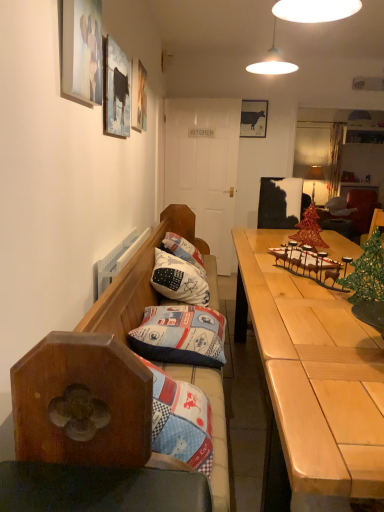
Find the location of a particular element. The image size is (384, 512). matte wooden picture frame at upper left, marked as the third picture frame in a right-to-left arrangement is located at coordinates (115, 90).

This screenshot has width=384, height=512. Describe the element at coordinates (115, 90) in the screenshot. I see `matte wooden picture frame at upper left, arranged as the 3th picture frame when viewed from the back` at that location.

Locate an element on the screen. The image size is (384, 512). wooden bench with cushions at left is located at coordinates [95, 356].

Where is `matte glass lampshade at upper right`? The width and height of the screenshot is (384, 512). matte glass lampshade at upper right is located at coordinates (316, 185).

This screenshot has width=384, height=512. Describe the element at coordinates (316, 185) in the screenshot. I see `matte glass lampshade at upper right` at that location.

Identify the location of matte wooden picture frame at upper left, the 1th picture frame viewed from the front. The width and height of the screenshot is (384, 512). (82, 50).

From a real-world perspective, is wooden picture frame at upper center, which is the 3th picture frame from front to back, positioned under light wood table at right based on gravity?

No.

Would you say light wood table at right is part of wooden picture frame at upper center, which is the 3th picture frame from front to back,'s contents?

Actually, light wood table at right is outside wooden picture frame at upper center, which is the 3th picture frame from front to back.

Which is in front, point (183, 283) or point (142, 80)?

The point (183, 283) is closer.

Considering the sizes of white cotton pillow at center, placed as the first pillow when sorted from back to front, and wooden picture frame at upper center, acting as the 3th picture frame starting from the left, in the image, is white cotton pillow at center, placed as the first pillow when sorted from back to front, wider or thinner than wooden picture frame at upper center, acting as the 3th picture frame starting from the left,?

In the image, white cotton pillow at center, placed as the first pillow when sorted from back to front, appears to be wider than wooden picture frame at upper center, acting as the 3th picture frame starting from the left.

Is white cotton pillow at center, the 2th pillow in the front-to-back sequence, not close to wooden picture frame at upper center, acting as the 3th picture frame starting from the left?

No, white cotton pillow at center, the 2th pillow in the front-to-back sequence, is not far away from wooden picture frame at upper center, acting as the 3th picture frame starting from the left.

Looking at this image, between light wood table at right and white cotton pillow at center, placed as the first pillow when sorted from back to front, which one has smaller size?

With smaller size is white cotton pillow at center, placed as the first pillow when sorted from back to front.

From the image's perspective, which is above, light wood table at right or white cotton pillow at center, the 2th pillow in the front-to-back sequence?

white cotton pillow at center, the 2th pillow in the front-to-back sequence, from the image's perspective.

Looking at this image, does light wood table at right contain white cotton pillow at center, placed as the first pillow when sorted from back to front?

No, white cotton pillow at center, placed as the first pillow when sorted from back to front, is located outside of light wood table at right.

Considering the positions of points (324, 405) and (179, 260), is point (324, 405) closer to camera compared to point (179, 260)?

That is True.

Is wooden picture frame at upper center, which is the 3th picture frame from front to back, at the back of matte black cow at upper center, which is the first picture frame in back-to-front order?

No, matte black cow at upper center, which is the first picture frame in back-to-front order, is not facing away from wooden picture frame at upper center, which is the 3th picture frame from front to back.

From a real-world perspective, is matte black cow at upper center, the fourth picture frame from the left, above or below wooden picture frame at upper center, which is the 3th picture frame from front to back?

In terms of real-world spatial position, matte black cow at upper center, the fourth picture frame from the left, is above wooden picture frame at upper center, which is the 3th picture frame from front to back.

Is wooden picture frame at upper center, acting as the 3th picture frame starting from the left, surrounded by matte black cow at upper center, placed as the first picture frame when sorted from right to left?

No, wooden picture frame at upper center, acting as the 3th picture frame starting from the left, is not a part of matte black cow at upper center, placed as the first picture frame when sorted from right to left.

Which object is further away from the camera, matte black cow at upper center, the fourth picture frame from the left, or wooden picture frame at upper center, acting as the 3th picture frame starting from the left?

matte black cow at upper center, the fourth picture frame from the left, is further away from the camera.

Is matte wooden picture frame at upper left, the 1th picture frame when ordered from left to right, positioned with its back to light wood table at right?

No.

Is matte wooden picture frame at upper left, marked as the 4th picture frame in a right-to-left arrangement, beside light wood table at right?

matte wooden picture frame at upper left, marked as the 4th picture frame in a right-to-left arrangement, and light wood table at right are clearly separated.

How much distance is there between matte wooden picture frame at upper left, the 1th picture frame viewed from the front, and light wood table at right?

matte wooden picture frame at upper left, the 1th picture frame viewed from the front, is 3.83 feet away from light wood table at right.

Which of these two, matte wooden picture frame at upper left, marked as the 4th picture frame in a right-to-left arrangement, or light wood table at right, is smaller?

Smaller between the two is matte wooden picture frame at upper left, marked as the 4th picture frame in a right-to-left arrangement.

Looking at this image, which of these two, velvet dark brown bean bag chair at right or light wood table at right, is bigger?

light wood table at right is bigger.

Considering the relative positions of velvet dark brown bean bag chair at right and light wood table at right in the image provided, is velvet dark brown bean bag chair at right to the left of light wood table at right from the viewer's perspective?

No.

Identify the location of desk lying below the velvet dark brown bean bag chair at right (from the image's perspective). The height and width of the screenshot is (512, 384). (311, 380).

Is white cotton pillow at center, placed as the first pillow when sorted from back to front, looking in the opposite direction of wooden bench with cushions at left?

Yes, white cotton pillow at center, placed as the first pillow when sorted from back to front, is facing away from wooden bench with cushions at left.

Are white cotton pillow at center, the 2th pillow in the front-to-back sequence, and wooden bench with cushions at left beside each other?

No, white cotton pillow at center, the 2th pillow in the front-to-back sequence, is not with wooden bench with cushions at left.

Is point (189, 270) more distant than point (110, 399)?

Yes, it is behind point (110, 399).

Which of these two, white cotton pillow at center, placed as the first pillow when sorted from back to front, or wooden bench with cushions at left, stands shorter?

white cotton pillow at center, placed as the first pillow when sorted from back to front.

Identify the location of desk in front of the wooden picture frame at upper center, which is the 3th picture frame from front to back. The image size is (384, 512). (311, 380).

Which picture frame is the 1st one when counting from the back of the white cotton pillow at center, placed as the first pillow when sorted from back to front? Please provide its 2D coordinates.

[(138, 96)]

Estimate the real-world distances between objects in this image. Which object is further from matte black cow at upper center, the fourth picture frame from the left, wooden picture frame at upper center, positioned as the 2th picture frame in back-to-front order, or velvet dark brown bean bag chair at right?

wooden picture frame at upper center, positioned as the 2th picture frame in back-to-front order, is positioned further to the anchor matte black cow at upper center, the fourth picture frame from the left.

Based on their spatial positions, is light wood table at right or white cotton pillow at center, the 2th pillow in the front-to-back sequence, closer to matte wooden picture frame at upper left, the 1th picture frame viewed from the front?

Based on the image, light wood table at right appears to be nearer to matte wooden picture frame at upper left, the 1th picture frame viewed from the front.

Considering their positions, is wooden picture frame at upper center, which is the 3th picture frame from front to back, positioned closer to matte glass lampshade at upper right than matte wooden picture frame at upper left, the 1th picture frame viewed from the front?

The object closer to matte glass lampshade at upper right is wooden picture frame at upper center, which is the 3th picture frame from front to back.

Looking at the image, which one is located further to wooden picture frame at upper center, acting as the 3th picture frame starting from the left, matte wooden picture frame at upper left, the fourth picture frame viewed from the back, or wooden bench with cushions at left?

wooden bench with cushions at left is further to wooden picture frame at upper center, acting as the 3th picture frame starting from the left.

In the scene shown: Considering their positions, is matte glass lampshade at upper right positioned closer to matte wooden picture frame at upper left, marked as the 4th picture frame in a right-to-left arrangement, than matte wooden picture frame at upper left, which is the 2th picture frame in front-to-back order?

matte wooden picture frame at upper left, which is the 2th picture frame in front-to-back order.

From the image, which object appears to be farther from matte wooden picture frame at upper left, the 1th picture frame when ordered from left to right, light wood table at right or velvet dark brown bean bag chair at right?

Based on the image, velvet dark brown bean bag chair at right appears to be further to matte wooden picture frame at upper left, the 1th picture frame when ordered from left to right.

Estimate the real-world distances between objects in this image. Which object is closer to wooden picture frame at upper center, placed as the 2th picture frame when sorted from right to left, matte glass lampshade at upper right or white cotton pillow at center, the 2th pillow in the front-to-back sequence?

white cotton pillow at center, the 2th pillow in the front-to-back sequence.

Estimate the real-world distances between objects in this image. Which object is further from wooden picture frame at upper center, acting as the 3th picture frame starting from the left, blue cotton cushion at center, placed as the 2th pillow when sorted from back to front, or white cotton pillow at center, the 2th pillow in the front-to-back sequence?

blue cotton cushion at center, placed as the 2th pillow when sorted from back to front, is further to wooden picture frame at upper center, acting as the 3th picture frame starting from the left.

Identify the location of picture frame positioned between wooden picture frame at upper center, positioned as the 2th picture frame in back-to-front order, and matte glass lampshade at upper right from near to far. [x=253, y=118].

Where is `picture frame between wooden picture frame at upper center, positioned as the 2th picture frame in back-to-front order, and velvet dark brown bean bag chair at right in the front-back direction`? This screenshot has width=384, height=512. picture frame between wooden picture frame at upper center, positioned as the 2th picture frame in back-to-front order, and velvet dark brown bean bag chair at right in the front-back direction is located at coordinates (253, 118).

I want to click on pillow between wooden picture frame at upper center, positioned as the 2th picture frame in back-to-front order, and blue cotton cushion at center, which is the 1th pillow from front to back, vertically, so click(179, 279).

Find the location of a particular element. studio couch between light wood table at right and matte glass lampshade at upper right in the front-back direction is located at coordinates (95, 356).